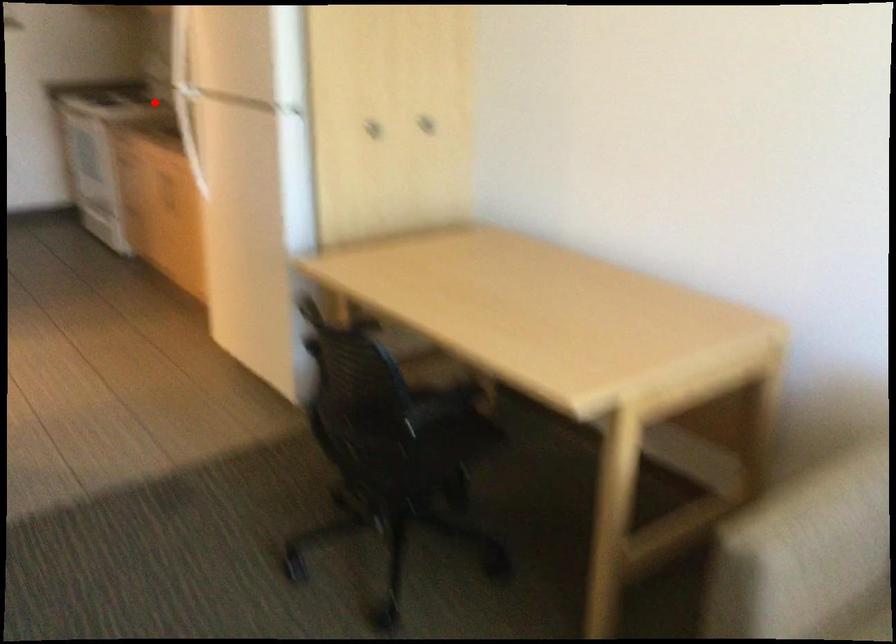
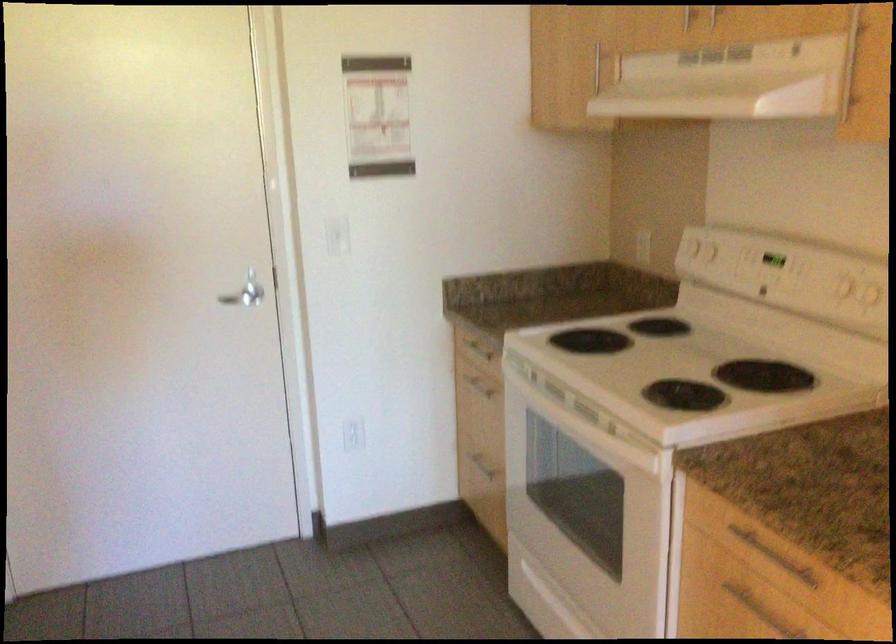
Question: I am providing you with two images of the same scene from different viewpoints. Given a red point in image1, look at the same physical point in image2. Is it:

Choices:
 (A) Closer to the viewpoint
 (B) Farther from the viewpoint

Answer: (A)